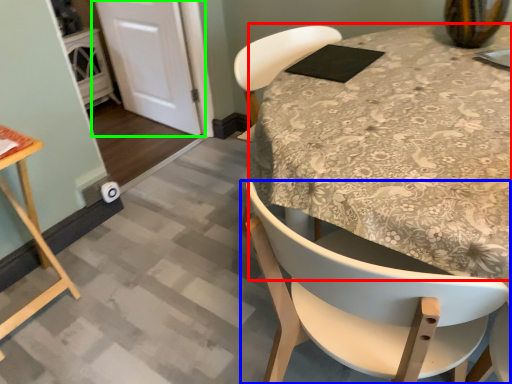
Question: Which is nearer to the round table (highlighted by a red box)? chair (highlighted by a blue box) or door (highlighted by a green box).

Choices:
 (A) chair
 (B) door

Answer: (A)